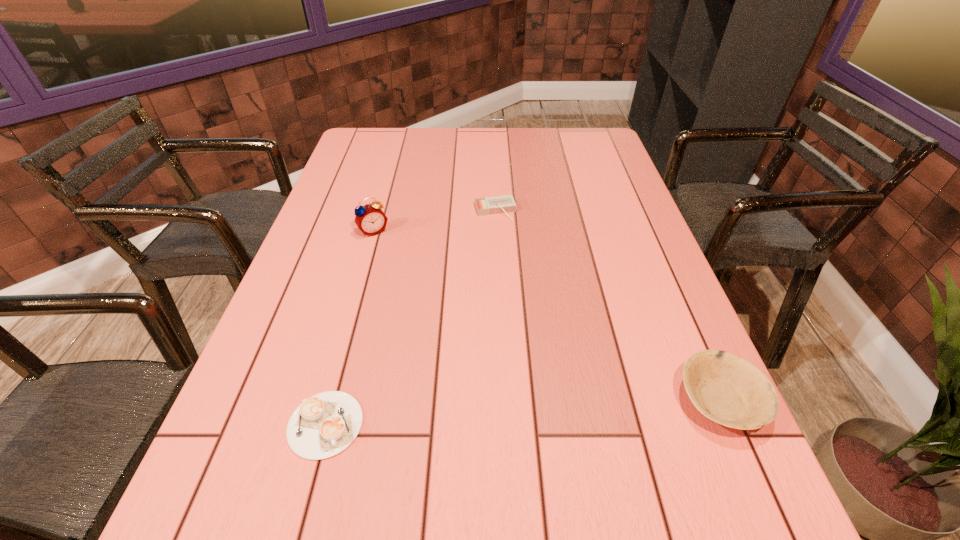
I want to click on free spot on the desktop that is between the shortest object and the second tallest object and is positioned on the front-facing side of the tallest object, so click(x=494, y=414).

At what (x,y) coordinates should I click in order to perform the action: click on vacant space on the desktop that is between the cappuccino and the rightmost object and is positioned on the striking surface of the farthest object. Please return your answer as a coordinate pair (x, y). Image resolution: width=960 pixels, height=540 pixels. Looking at the image, I should click on (566, 410).